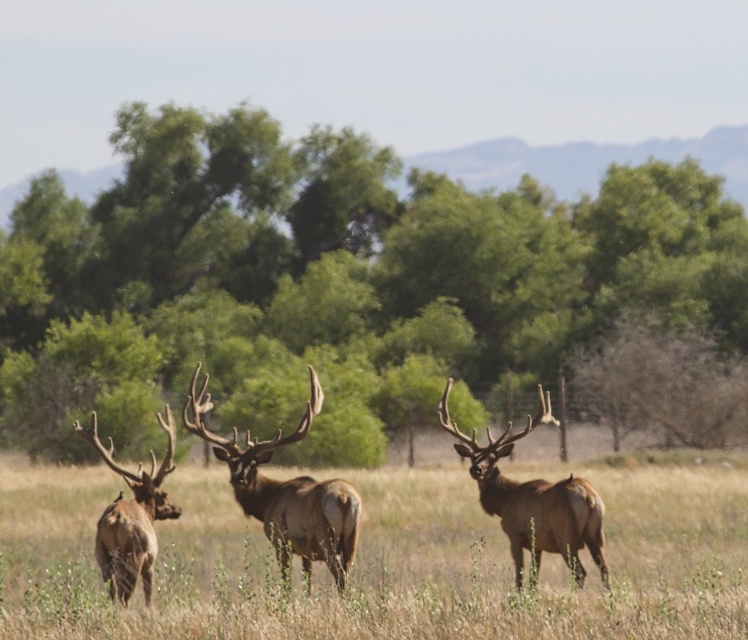
Does brown grass at center have a greater height compared to brown velvet deer at center?

Yes.

Does point (628, 550) come in front of point (285, 579)?

No, (628, 550) is further to viewer.

Where is `brown grass at center`? The width and height of the screenshot is (748, 640). brown grass at center is located at coordinates click(380, 561).

Locate an element on the screen. Image resolution: width=748 pixels, height=640 pixels. brown grass at center is located at coordinates (380, 561).

Describe the element at coordinates (334, 284) in the screenshot. I see `green leafy tree at center` at that location.

Image resolution: width=748 pixels, height=640 pixels. In order to click on green leafy tree at center in this screenshot , I will do `click(334, 284)`.

What do you see at coordinates (334, 284) in the screenshot? I see `green leafy tree at center` at bounding box center [334, 284].

You are a GUI agent. You are given a task and a screenshot of the screen. Output one action in this format:
    pyautogui.click(x=<x>, y=<y>)
    Task: Click on the green leafy tree at center
    This screenshot has height=640, width=748.
    Given the screenshot: What is the action you would take?
    pyautogui.click(x=334, y=284)

Is point (536, 234) more distant than point (511, 490)?

That is True.

Which is in front, point (212, 269) or point (536, 419)?

Point (536, 419) is more forward.

Between point (251, 374) and point (511, 513), which one is positioned behind?

The point (251, 374) is behind.

The width and height of the screenshot is (748, 640). I want to click on green leafy tree at center, so click(334, 284).